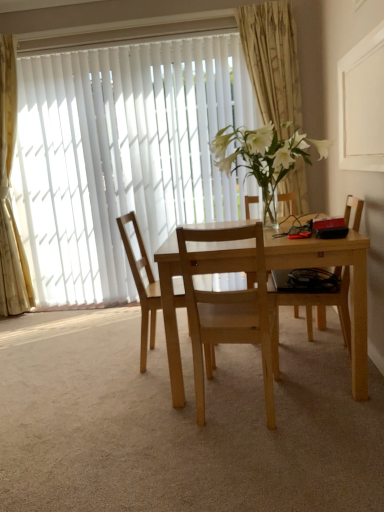
Find the location of `free space in front of light wood chair at center, which is the second chair in right-to-left order`. free space in front of light wood chair at center, which is the second chair in right-to-left order is located at coordinates (257, 458).